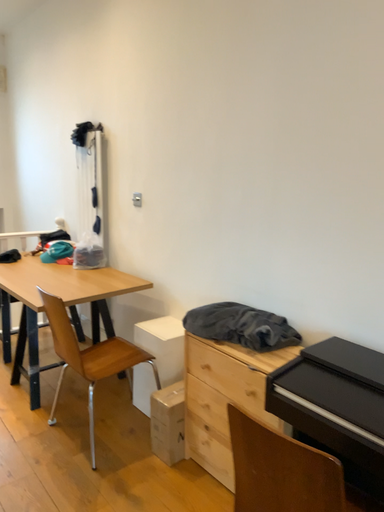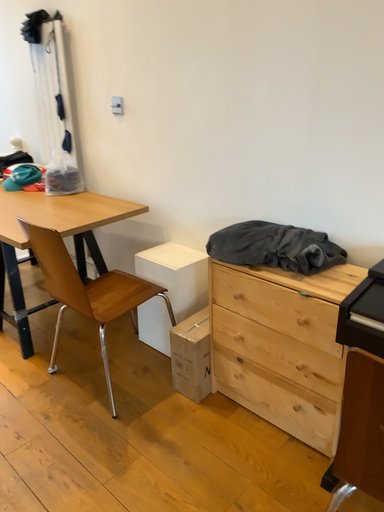
Question: How did the camera likely rotate when shooting the video?

Choices:
 (A) rotated left
 (B) rotated right

Answer: (B)